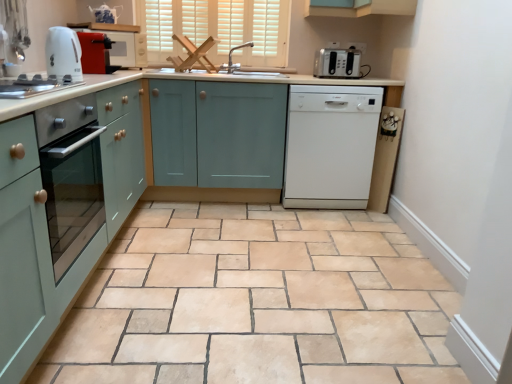
Where is `empty space that is ontop of natural stone floor at center (from a real-world perspective)`? empty space that is ontop of natural stone floor at center (from a real-world perspective) is located at coordinates (261, 259).